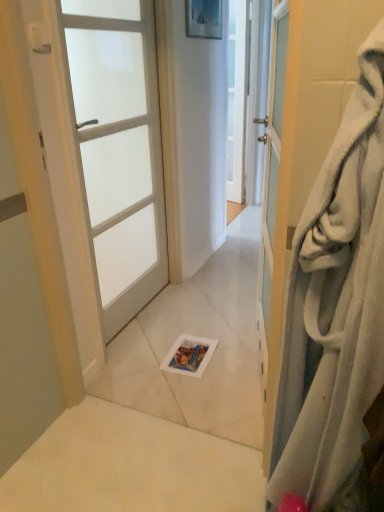
At what (x,y) coordinates should I click in order to perform the action: click on vacant space in front of white frosted glass door at left, acting as the 2th door starting from the front. Please return your answer as a coordinate pair (x, y). The width and height of the screenshot is (384, 512). Looking at the image, I should click on (165, 360).